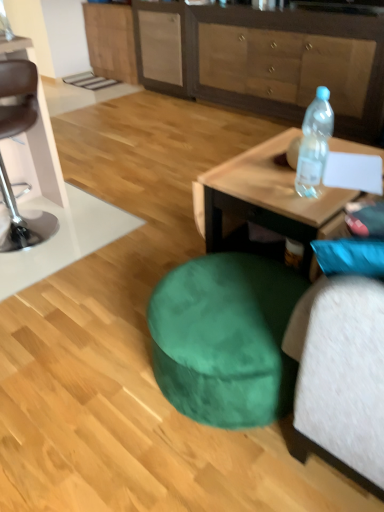
This screenshot has height=512, width=384. I want to click on vacant area situated to the left side of velvet green bean bag at lower center, so click(x=85, y=374).